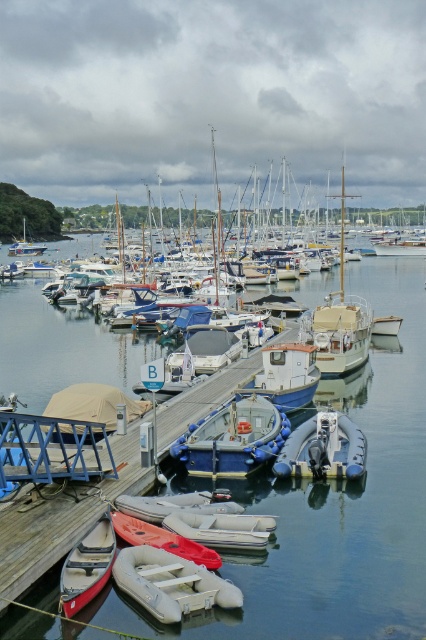
Question: Can you confirm if gray rubber dinghy at lower center is positioned to the right of gray rubber dinghy at center?

Choices:
 (A) no
 (B) yes

Answer: (A)

Question: Is rubber dinghy at center to the left of rubber kayak at lower center from the viewer's perspective?

Choices:
 (A) no
 (B) yes

Answer: (A)

Question: Among these points, which one is nearest to the camera?

Choices:
 (A) (218, 516)
 (B) (233, 502)
 (C) (373, 333)
 (D) (279, 412)

Answer: (A)

Question: Which point is farther from the camera taking this photo?

Choices:
 (A) (78, 552)
 (B) (230, 502)
 (C) (11, 253)
 (D) (391, 477)

Answer: (C)

Question: Which is farther from the blue rubber dinghy at center?

Choices:
 (A) gray rubber dinghy at lower center
 (B) white matte sailboat at center
 (C) clear water at center
 (D) rubber dinghy at center

Answer: (B)

Question: Can you confirm if wooden sailboat at center is smaller than matte white sailboat at left?

Choices:
 (A) no
 (B) yes

Answer: (A)